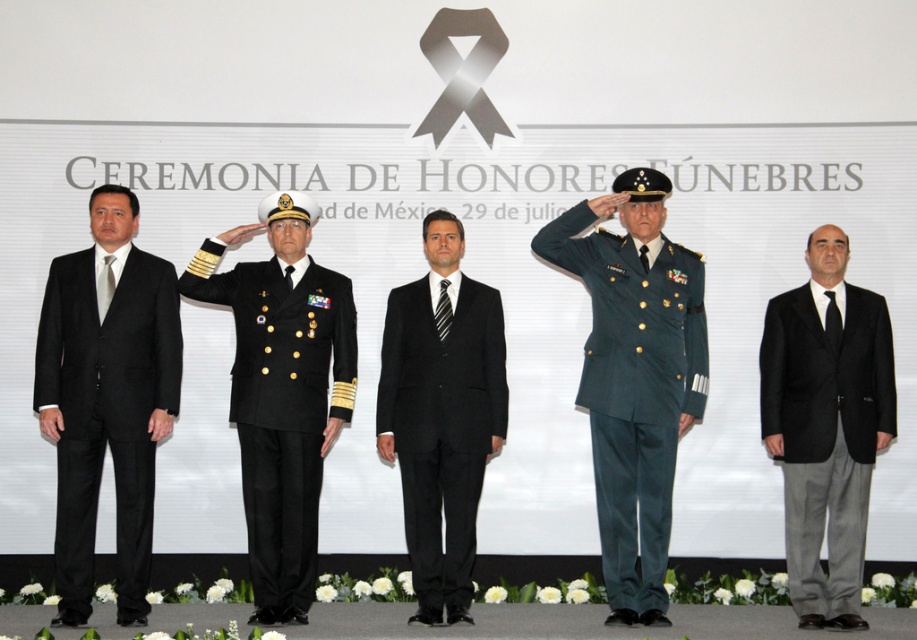
You are a photographer positioned behind the stage. You need to capture a photo of the green military uniform at center and the black wool suit at center. Given that your camera has a maximum focus range of 30 inches, can you capture both subjects in focus without moving closer?

The distance between the green military uniform at center and the black wool suit at center is 30.72 inches, which exceeds the camera maximum focus range of 30 inches. Therefore, you cannot capture both subjects in focus without moving closer.

You are attending the ceremony and need to identify the tallest person between the black wool military uniform at center and the black wool suit at center. Which one is taller?

The black wool military uniform at center is taller than the black wool suit at center according to the description.